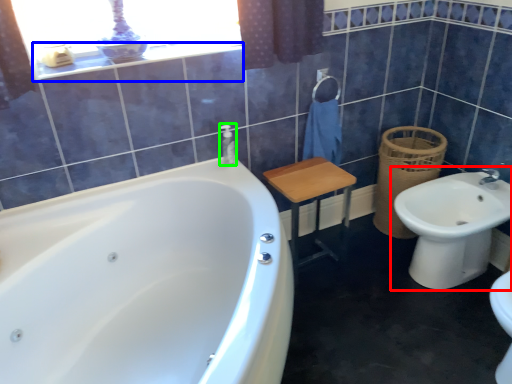
Question: Based on their relative distances, which object is farther from sink (highlighted by a red box)? Choose from balustrade (highlighted by a blue box) and toiletry (highlighted by a green box).

Choices:
 (A) balustrade
 (B) toiletry

Answer: (A)